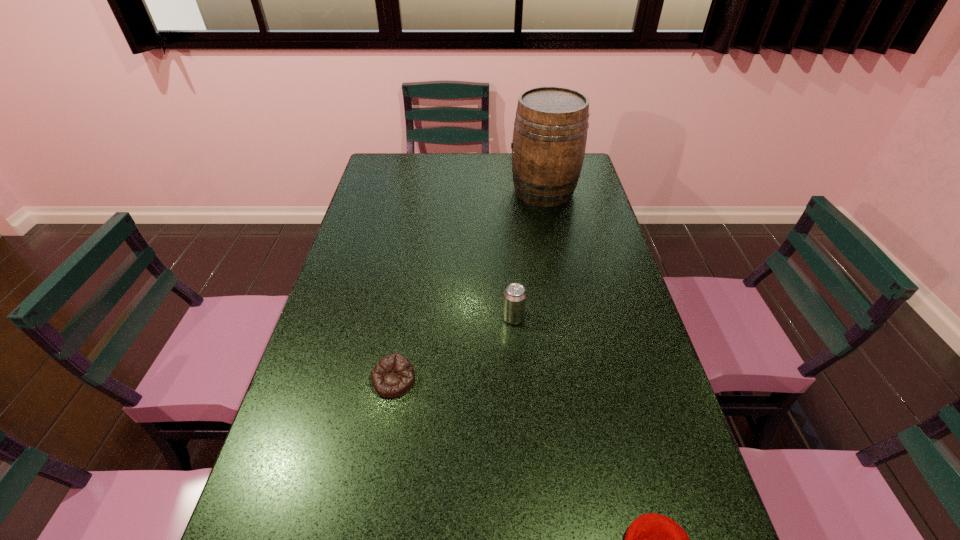
Where is `free spot located on the front of the shortest object`? The height and width of the screenshot is (540, 960). free spot located on the front of the shortest object is located at coordinates (380, 468).

At what (x,y) coordinates should I click in order to perform the action: click on object located in the far edge section of the desktop. Please return your answer as a coordinate pair (x, y). Looking at the image, I should click on (550, 130).

Locate an element on the screen. Image resolution: width=960 pixels, height=540 pixels. object that is at the right edge is located at coordinates (550, 130).

Where is `object positioned at the far right corner`? The width and height of the screenshot is (960, 540). object positioned at the far right corner is located at coordinates (550, 130).

At what (x,y) coordinates should I click in order to perform the action: click on vacant space at the far edge. Please return your answer as a coordinate pair (x, y). This screenshot has width=960, height=540. Looking at the image, I should click on (508, 161).

At what (x,y) coordinates should I click in order to perform the action: click on free space at the left edge of the desktop. Please return your answer as a coordinate pair (x, y). This screenshot has width=960, height=540. Looking at the image, I should click on (374, 191).

The height and width of the screenshot is (540, 960). In the image, there is a desktop. What are the coordinates of `vacant space at the right edge` in the screenshot? It's located at (619, 382).

Where is `empty location between the cider and the leftmost object`? The image size is (960, 540). empty location between the cider and the leftmost object is located at coordinates (468, 286).

The image size is (960, 540). What are the coordinates of `vacant space that's between the cider and the third nearest object` in the screenshot? It's located at (528, 254).

Identify the location of empty location between the left beanbag and the tallest object. (468, 286).